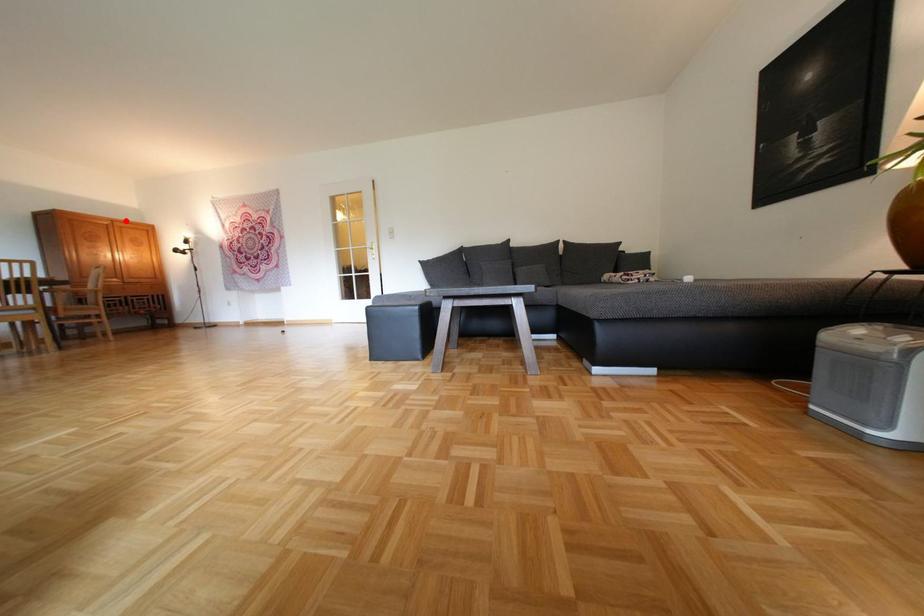
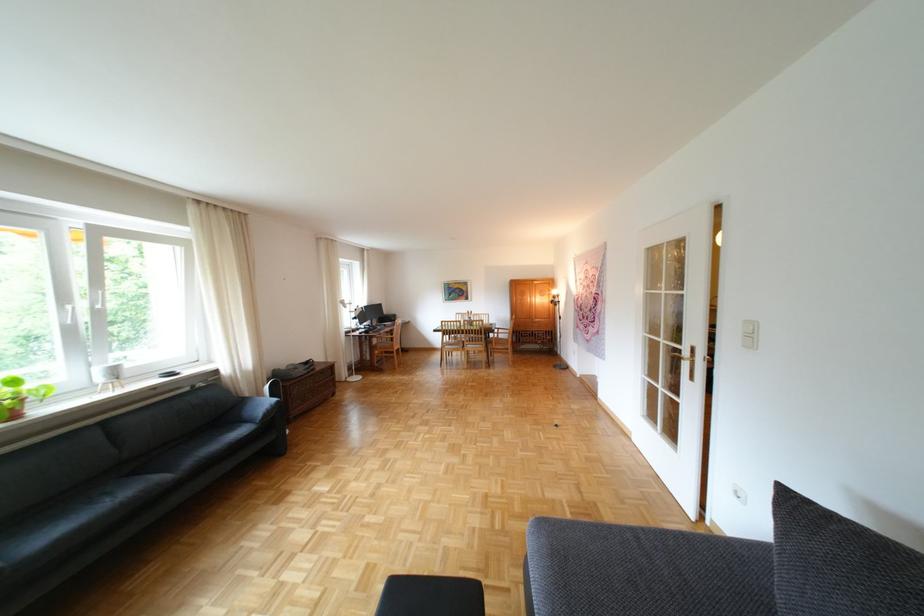
In the second image, find the point that corresponds to the highlighted location in the first image.

(544, 281)